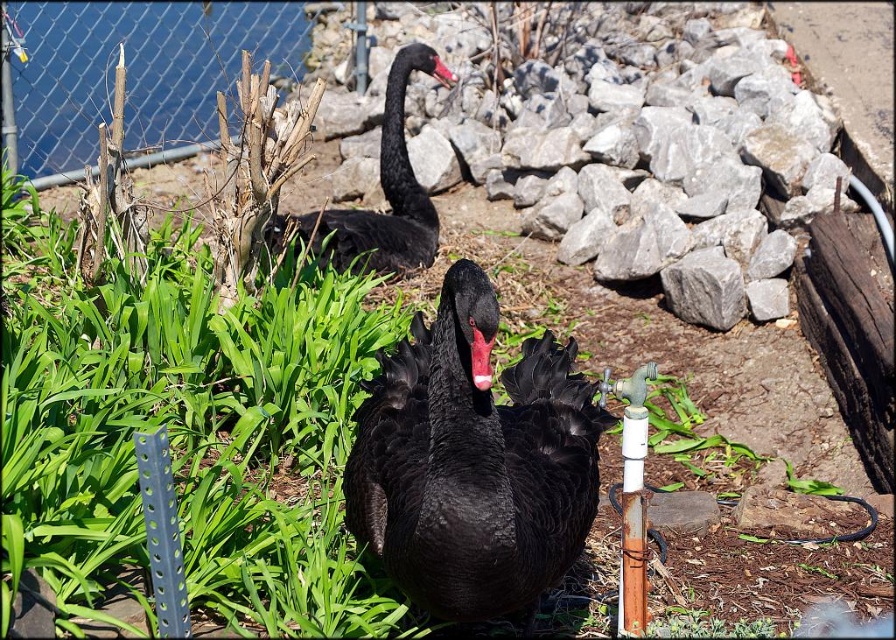
Question: Which point is farther to the camera?

Choices:
 (A) (487, 387)
 (B) (461, 593)

Answer: (B)

Question: Does gray rock at center come in front of metallic chain-link fence at upper left?

Choices:
 (A) yes
 (B) no

Answer: (A)

Question: Which point is farther from the camera taking this photo?

Choices:
 (A) (415, 180)
 (B) (186, 131)
 (C) (601, 266)

Answer: (B)

Question: Is gray rock at center to the right of black matte beak at upper center from the viewer's perspective?

Choices:
 (A) no
 (B) yes

Answer: (B)

Question: Can you confirm if metallic chain-link fence at upper left is bigger than black matte beak at upper center?

Choices:
 (A) no
 (B) yes

Answer: (B)

Question: Which object is the closest to the metallic chain-link fence at upper left?

Choices:
 (A) matte black swan at center
 (B) red matte beak at center
 (C) matte black swan at upper center
 (D) gray rock at center

Answer: (D)